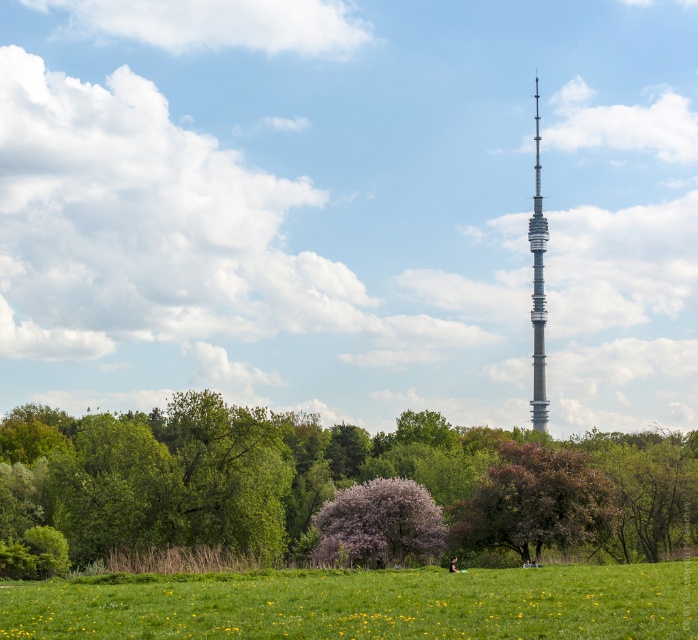
From the picture: Between pink blossoming tree at center and gray metallic tower at center, which one is positioned lower?

Positioned lower is pink blossoming tree at center.

Does pink blossoming tree at center appear under gray metallic tower at center?

Yes, pink blossoming tree at center is below gray metallic tower at center.

The image size is (698, 640). Identify the location of pink blossoming tree at center. (378, 524).

Does pink blossoming tree at center have a greater height compared to silver metallic tower at center?

Incorrect, pink blossoming tree at center's height is not larger of silver metallic tower at center's.

Identify the location of pink blossoming tree at center. The image size is (698, 640). (378, 524).

Does green leafy tree at center have a greater width compared to purple-blooming tree at center?

Correct, the width of green leafy tree at center exceeds that of purple-blooming tree at center.

Between point (98, 442) and point (475, 509), which one is positioned behind?

The point (98, 442) is more distant.

The height and width of the screenshot is (640, 698). What are the coordinates of `green leafy tree at center` in the screenshot? It's located at click(329, 480).

This screenshot has height=640, width=698. What are the coordinates of `green leafy tree at center` in the screenshot? It's located at (329, 480).